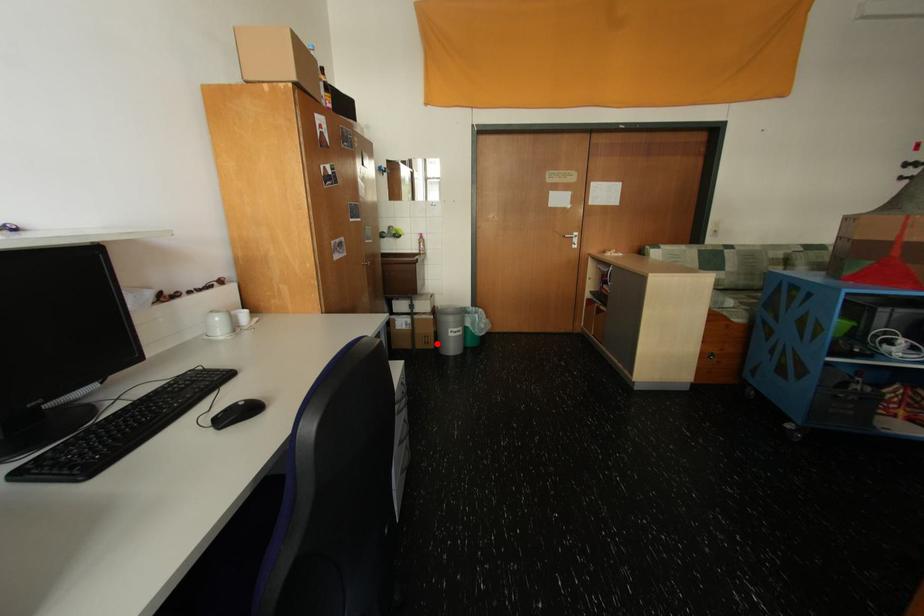
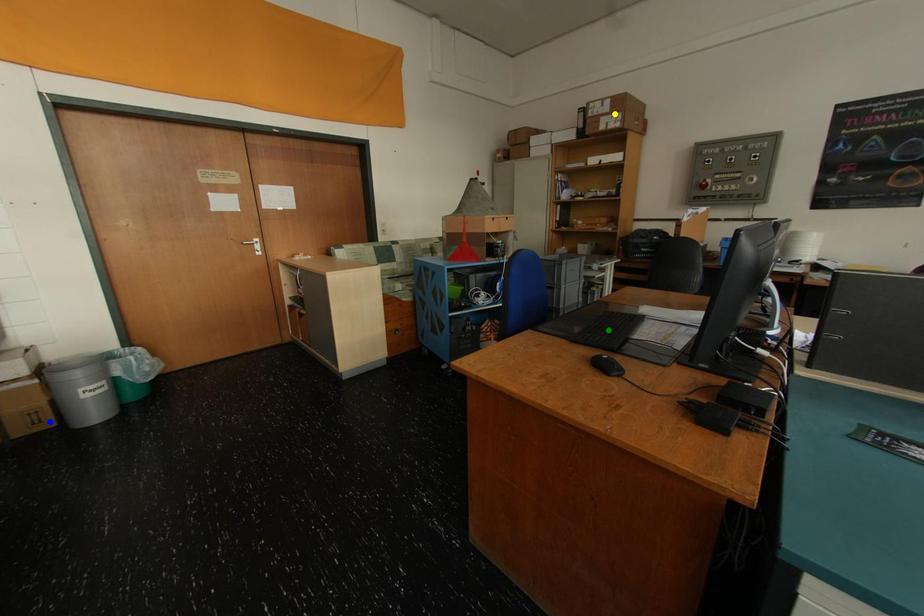
Question: I am providing you with two images of the same scene from different viewpoints. A red point is marked on the first image. You are given multiple points on the second image. Which mark in image 2 goes with the point in image 1?

Choices:
 (A) blue point
 (B) green point
 (C) yellow point

Answer: (A)